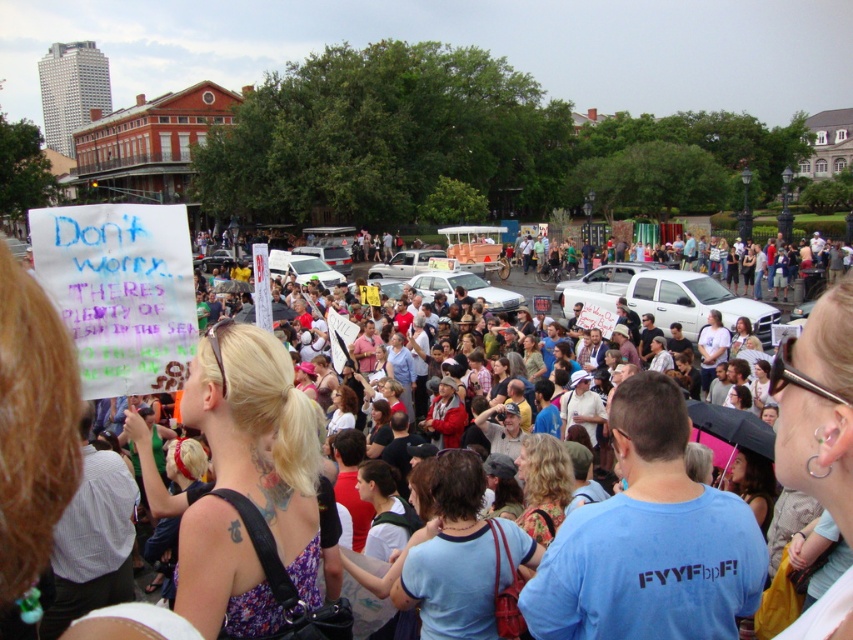
Can you confirm if blue cotton shirt at center is positioned to the left of floral fabric dress at center?

Yes, blue cotton shirt at center is to the left of floral fabric dress at center.

Can you confirm if blue cotton shirt at center is smaller than floral fabric dress at center?

No.

Which is behind, point (422, 621) or point (566, 500)?

Point (566, 500)

The width and height of the screenshot is (853, 640). Identify the location of blue cotton shirt at center. (x=450, y=554).

Is blue cotton shirt at center taller than matte black umbrella at lower right?

Indeed, blue cotton shirt at center has a greater height compared to matte black umbrella at lower right.

Does point (445, 577) lie in front of point (767, 476)?

Yes, it is.

Locate an element on the screen. The height and width of the screenshot is (640, 853). blue cotton shirt at center is located at coordinates (450, 554).

Who is more distant from viewer, (271, 625) or (766, 474)?

Point (766, 474)

Does floral dress at center have a lesser width compared to matte black umbrella at lower right?

No, floral dress at center is not thinner than matte black umbrella at lower right.

The image size is (853, 640). I want to click on floral dress at center, so click(260, 436).

Image resolution: width=853 pixels, height=640 pixels. I want to click on floral dress at center, so click(x=260, y=436).